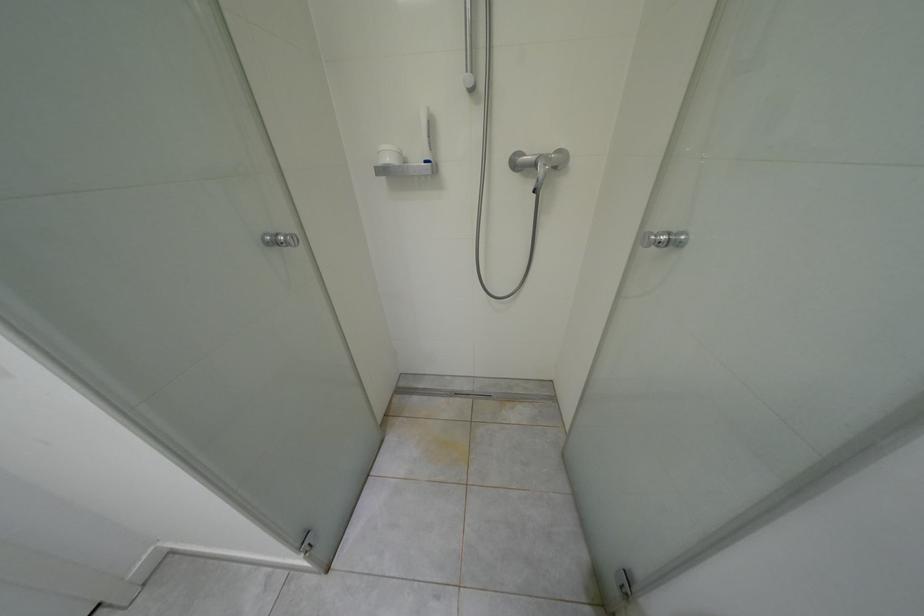
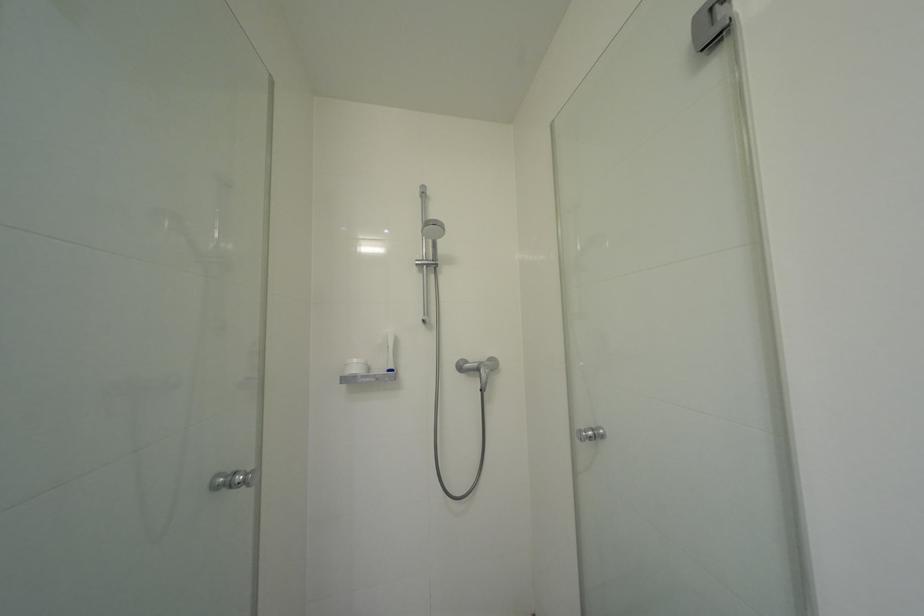
The images are taken continuously from a first-person perspective. In which direction is your viewpoint rotating?

The camera's rotation is toward right-up.